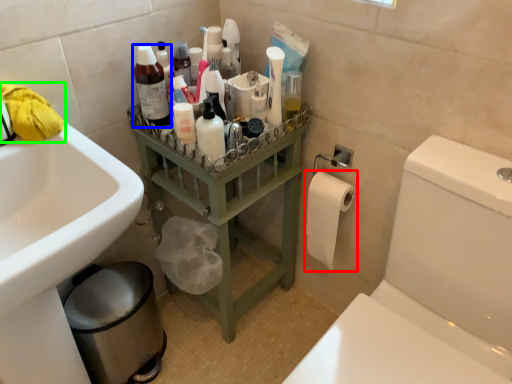
Question: Which is farther away from toilet paper (highlighted by a red box)? cleaning product (highlighted by a blue box) or material (highlighted by a green box)?

Choices:
 (A) cleaning product
 (B) material

Answer: (B)